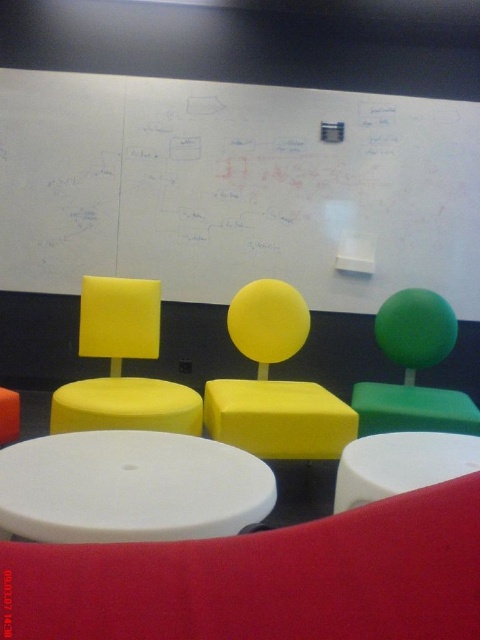
You are standing in the seating area and want to write a new idea on the whiteboard at upper center. To do so, you need to walk towards it. Based on the coordinates provided, in which general direction should you move from your current position?

The whiteboard at upper center is located at coordinates point (237, 189). Since the coordinate system is not specified, but typically in such contexts, the first value might represent the horizontal axis and the second the vertical. Assuming you are in the seating area, which is in the foreground, you would generally move forward towards the upper center direction to reach the whiteboard at upper center.

You are a person standing at the matte yellow chair at center. You need to reach the whiteboard at upper center to write something. Can you comfortably reach it without moving from your seat?

The distance between the whiteboard at upper center and the matte yellow chair at center is 1.54 meters. Since this distance is typical for such setups, you can comfortably reach the whiteboard at upper center from your seat without needing to move.